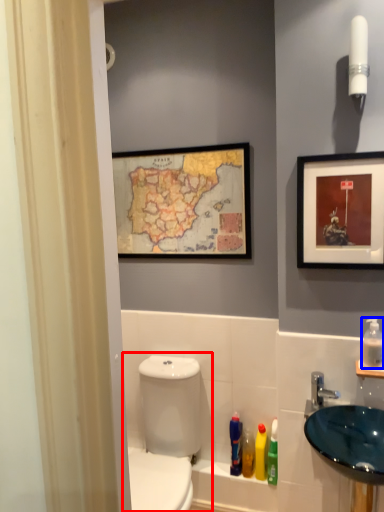
Question: Which object appears farthest to the camera in this image, toilet (highlighted by a red box) or mouthwash (highlighted by a blue box)?

Choices:
 (A) toilet
 (B) mouthwash

Answer: (B)